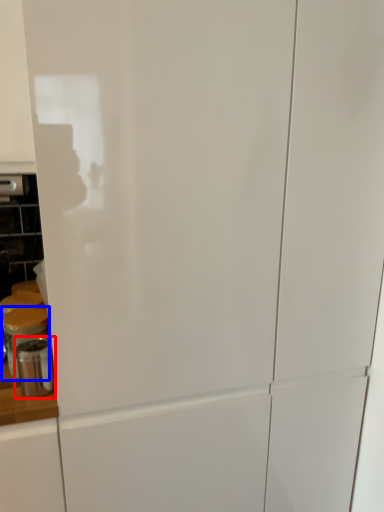
Question: Which object is closer to the camera taking this photo, appliance (highlighted by a red box) or appliance (highlighted by a blue box)?

Choices:
 (A) appliance
 (B) appliance

Answer: (A)